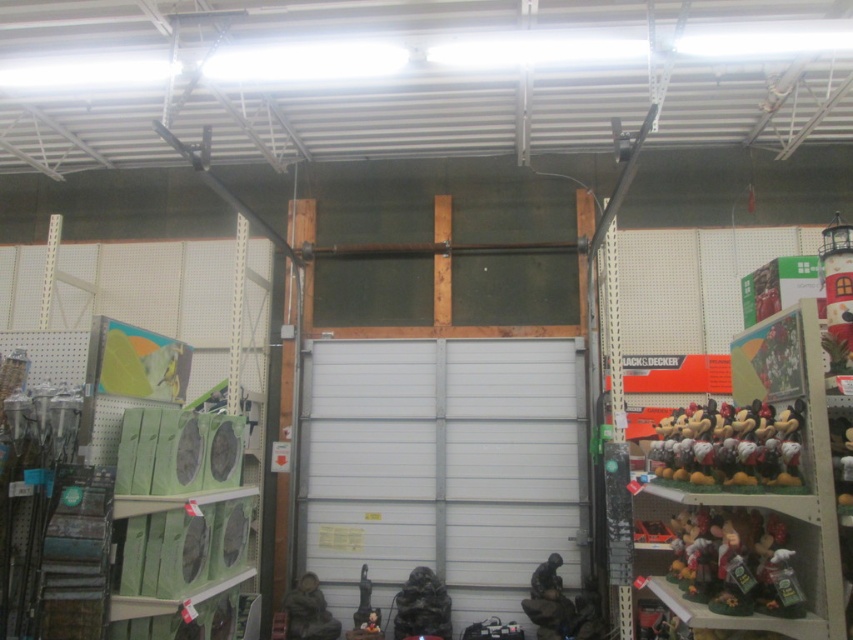
Measure the distance between point [409,509] and camera.

Point [409,509] and camera are 17.96 feet apart.

Between white matte garage door at center and black matte statue at center, which one appears on the left side from the viewer's perspective?

black matte statue at center is more to the left.

Who is more forward, (488, 355) or (430, 586)?

Point (430, 586) is more forward.

Locate an element on the screen. white matte garage door at center is located at coordinates (442, 467).

Measure the distance between plush mickey mouse figures at right and metallic bronze statue at lower center.

8.36 feet

Is plush mickey mouse figures at right wider than metallic bronze statue at lower center?

Yes, plush mickey mouse figures at right is wider than metallic bronze statue at lower center.

Is point (718, 534) positioned behind point (329, 634)?

No, it is not.

Identify the location of plush mickey mouse figures at right. The height and width of the screenshot is (640, 853). (750, 493).

Between matte brown figurine at lower right and plush mickey mouse toys at right, which one appears on the right side from the viewer's perspective?

Positioned to the right is plush mickey mouse toys at right.

In the scene shown: Does matte brown figurine at lower right appear on the right side of plush mickey mouse toys at right?

No, matte brown figurine at lower right is not to the right of plush mickey mouse toys at right.

Describe the element at coordinates (734, 561) in the screenshot. I see `matte brown figurine at lower right` at that location.

I want to click on matte brown figurine at lower right, so click(x=734, y=561).